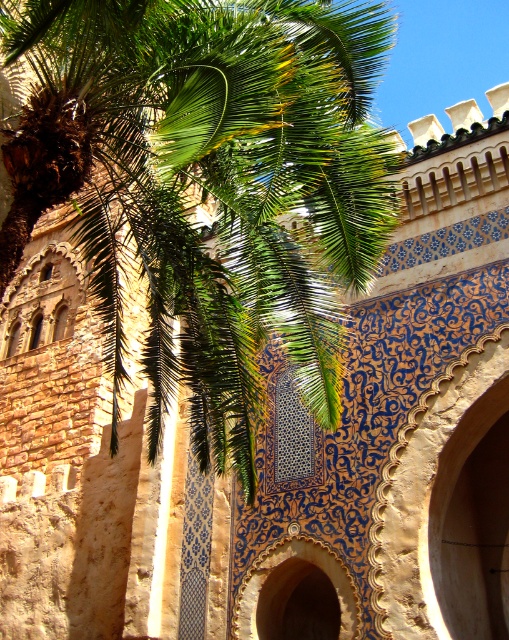
You are standing in front of the building with blue and white tiles. There is a point marked at coordinates (218,186). What object is located at that point?

The point at coordinates (218,186) corresponds to the green leafy palm at upper left.

You are an architect planning to take a photograph of the blue glazed tile archway at center. However, the green leafy palm at upper left is blocking part of the view. If you move 5 meters closer to the archway, will the palm still be in the frame?

The green leafy palm at upper left is 16.22 meters away from the blue glazed tile archway at center. Moving 5 meters closer reduces the distance to 11.22 meters. Since the palm is still within the vicinity, it will likely remain in the frame unless the camera angle is adjusted to exclude it.

You are an architect analyzing the layout of this historical site. You notice the green leafy palm at upper left and the blue glazed tile archway at center. Which object is located to the left of the other?

The green leafy palm at upper left is positioned on the left side of blue glazed tile archway at center.